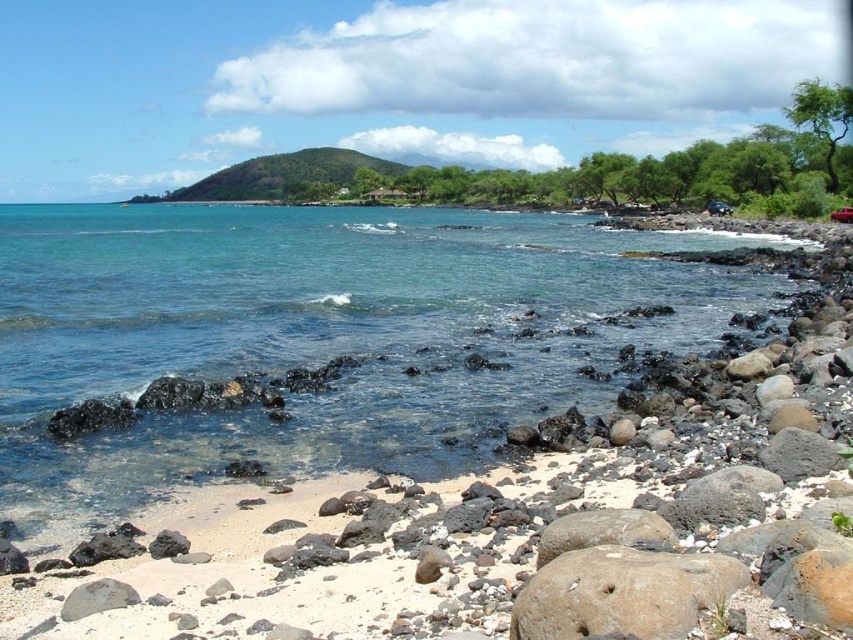
Can you confirm if clear blue water at center is positioned above green grassy hill at center?

Actually, clear blue water at center is below green grassy hill at center.

Who is more distant from viewer, (585, 404) or (229, 172)?

Positioned behind is point (229, 172).

The image size is (853, 640). I want to click on clear blue water at center, so click(318, 337).

Identify the location of clear blue water at center. (318, 337).

Is point (19, 253) in front of point (648, 588)?

No, (19, 253) is behind (648, 588).

The height and width of the screenshot is (640, 853). I want to click on clear blue water at center, so click(x=318, y=337).

Is brown rough rock at lower right above green grassy hill at center?

No, brown rough rock at lower right is not above green grassy hill at center.

Is point (548, 605) more distant than point (306, 148)?

No, (548, 605) is in front of (306, 148).

Identify the location of brown rough rock at lower right. Image resolution: width=853 pixels, height=640 pixels. (624, 593).